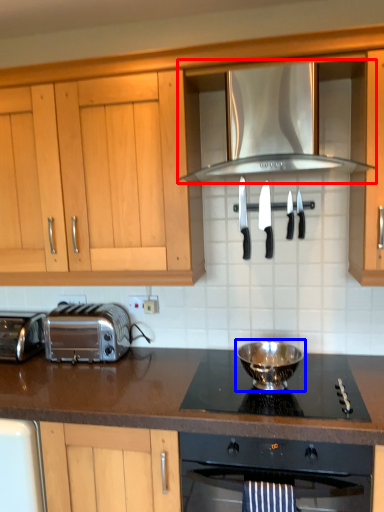
Question: Which object appears closest to the camera in this image, exhaust hood (highlighted by a red box) or kitchen appliance (highlighted by a blue box)?

Choices:
 (A) exhaust hood
 (B) kitchen appliance

Answer: (A)